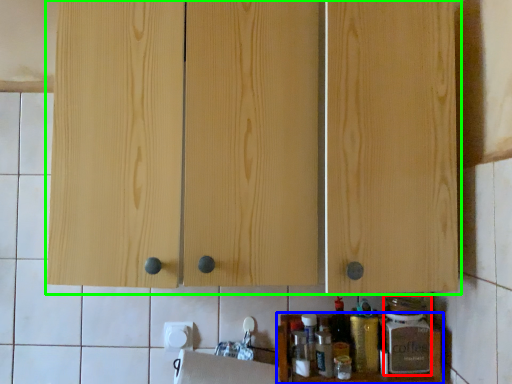
Question: Considering the real-world distances, which object is farthest from bottle (highlighted by a red box)? cabinet (highlighted by a blue box) or cabinetry (highlighted by a green box)?

Choices:
 (A) cabinet
 (B) cabinetry

Answer: (B)